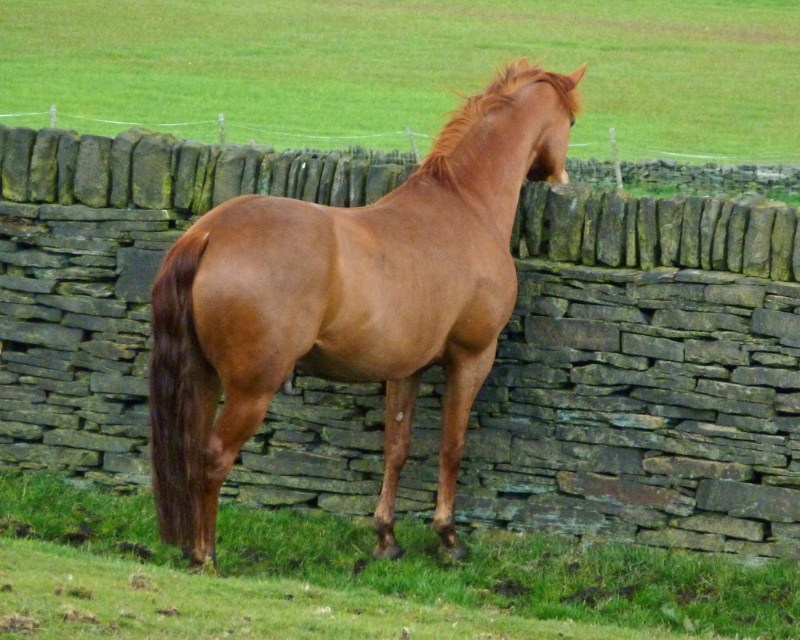
Is brown glossy horse at center thinner than green grass at lower center?

Correct, brown glossy horse at center's width is less than green grass at lower center's.

Between point (488, 211) and point (774, 605), which one is positioned in front?

Point (774, 605) is more forward.

Locate an element on the screen. brown glossy horse at center is located at coordinates (348, 304).

The width and height of the screenshot is (800, 640). What do you see at coordinates (408, 68) in the screenshot?
I see `green grass at center` at bounding box center [408, 68].

Does green grass at center have a greater width compared to brown glossy horse at center?

Correct, the width of green grass at center exceeds that of brown glossy horse at center.

Is point (636, 74) positioned in front of point (456, 170)?

No.

The height and width of the screenshot is (640, 800). What are the coordinates of `green grass at center` in the screenshot? It's located at (408, 68).

Is green grass at center to the right of green grass at lower center from the viewer's perspective?

No, green grass at center is not to the right of green grass at lower center.

Does point (508, 26) come in front of point (624, 620)?

No, it is not.

You are a GUI agent. You are given a task and a screenshot of the screen. Output one action in this format:
    pyautogui.click(x=<x>, y=<y>)
    Task: Click on the green grass at center
    The image size is (800, 640).
    Given the screenshot: What is the action you would take?
    pyautogui.click(x=408, y=68)

At what (x,y) coordinates should I click in order to perform the action: click on green grass at center. Please return your answer as a coordinate pair (x, y). Looking at the image, I should click on (408, 68).